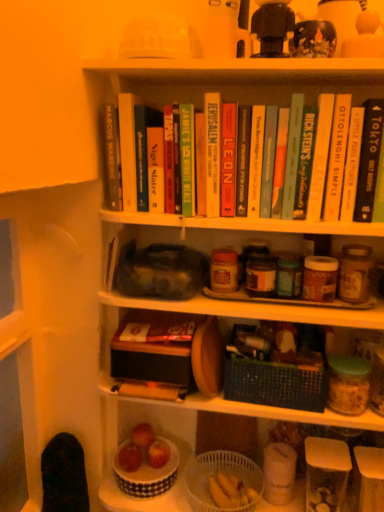
Question: Would you say hardcover book at upper center, marked as the ninth paperback book in a left-to-right arrangement, is to the left or to the right of hardcover book at upper center, the seventh paperback book viewed from the left, in the picture?

Choices:
 (A) right
 (B) left

Answer: (A)

Question: Which is correct: hardcover book at upper center, marked as the ninth paperback book in a left-to-right arrangement, is inside hardcover book at upper center, the 7th paperback book from the right, or outside of it?

Choices:
 (A) outside
 (B) inside

Answer: (A)

Question: Which object is the farthest from the white plastic basket at lower center, marked as the 1th shelf in a bottom-to-top arrangement?

Choices:
 (A) white plastic basket at lower center, the 2th basket in the top-to-bottom sequence
 (B) hardcover yellow book at upper center, marked as the third paperback book in a right-to-left arrangement
 (C) hardcover book at upper center, marked as the ninth paperback book in a left-to-right arrangement
 (D) hardcover book at upper center, which is the 4th paperback book in right-to-left order
 (E) hardcover book at upper right, marked as the thirteenth paperback book in a left-to-right arrangement

Answer: (E)

Question: Considering the real-world distances, which object is closest to the red matte apple at lower center?

Choices:
 (A) black plastic toy at upper center, the first toy positioned from the left
 (B) hardcover book at upper center, the 12th paperback book from the right
 (C) hardcover book at upper center, acting as the 10th paperback book starting from the left
 (D) white plastic basket at lower center, the 2th basket in the top-to-bottom sequence
 (E) hardcover book at center, which appears as the sixth paperback book when viewed from the left

Answer: (D)